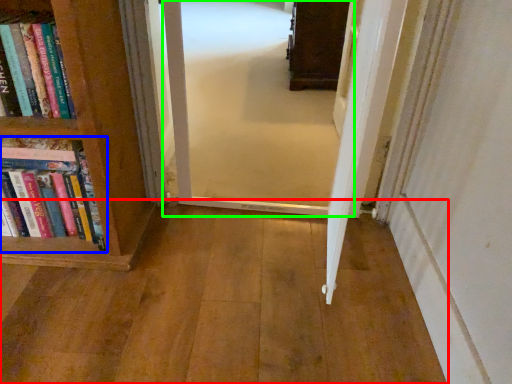
Question: Which object is the farthest from corridor (highlighted by a red box)? Choose among these: book (highlighted by a blue box) or corridor (highlighted by a green box).

Choices:
 (A) book
 (B) corridor

Answer: (B)